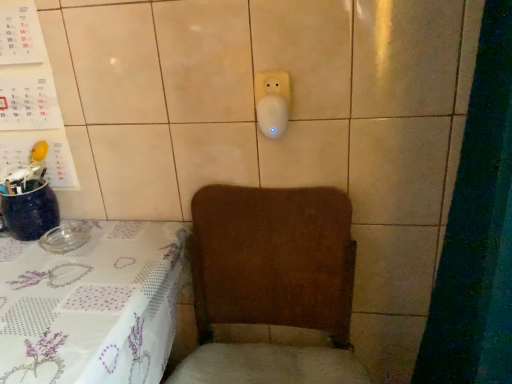
Question: Does white paper calendar at upper left turn towards brown fabric armchair at lower center?

Choices:
 (A) no
 (B) yes

Answer: (A)

Question: From the image's perspective, does white paper calendar at upper left appear higher than brown fabric armchair at lower center?

Choices:
 (A) no
 (B) yes

Answer: (B)

Question: Considering the relative sizes of white paper calendar at upper left and brown fabric armchair at lower center in the image provided, is white paper calendar at upper left shorter than brown fabric armchair at lower center?

Choices:
 (A) no
 (B) yes

Answer: (B)

Question: From the image's perspective, is white paper calendar at upper left under brown fabric armchair at lower center?

Choices:
 (A) no
 (B) yes

Answer: (A)

Question: Is the depth of white paper calendar at upper left greater than that of brown fabric armchair at lower center?

Choices:
 (A) yes
 (B) no

Answer: (A)

Question: From the image's perspective, is white paper calendar at upper left positioned above or below white plastic socket at upper center?

Choices:
 (A) below
 (B) above

Answer: (A)

Question: Is point click(x=30, y=21) closer or farther from the camera than point click(x=275, y=94)?

Choices:
 (A) farther
 (B) closer

Answer: (A)

Question: Choose the correct answer: Is white paper calendar at upper left inside white plastic socket at upper center or outside it?

Choices:
 (A) inside
 (B) outside

Answer: (B)

Question: In terms of size, does white paper calendar at upper left appear bigger or smaller than white plastic socket at upper center?

Choices:
 (A) small
 (B) big

Answer: (B)

Question: Considering the positions of white printed fabric tablecloth at lower left and brown fabric armchair at lower center in the image, is white printed fabric tablecloth at lower left bigger or smaller than brown fabric armchair at lower center?

Choices:
 (A) big
 (B) small

Answer: (A)

Question: From a real-world perspective, relative to brown fabric armchair at lower center, is white printed fabric tablecloth at lower left vertically above or below?

Choices:
 (A) above
 (B) below

Answer: (B)

Question: From the image's perspective, relative to brown fabric armchair at lower center, is white printed fabric tablecloth at lower left above or below?

Choices:
 (A) above
 (B) below

Answer: (B)

Question: Considering the positions of white printed fabric tablecloth at lower left and brown fabric armchair at lower center in the image, is white printed fabric tablecloth at lower left taller or shorter than brown fabric armchair at lower center?

Choices:
 (A) tall
 (B) short

Answer: (B)

Question: From a real-world perspective, is brown fabric armchair at lower center positioned above or below white plastic socket at upper center?

Choices:
 (A) above
 (B) below

Answer: (B)

Question: In terms of size, does brown fabric armchair at lower center appear bigger or smaller than white plastic socket at upper center?

Choices:
 (A) big
 (B) small

Answer: (A)